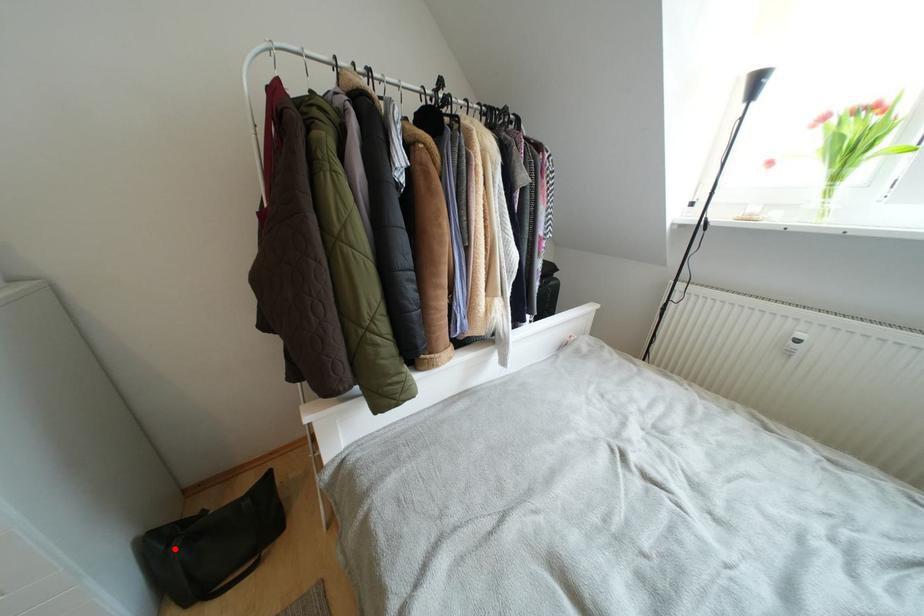
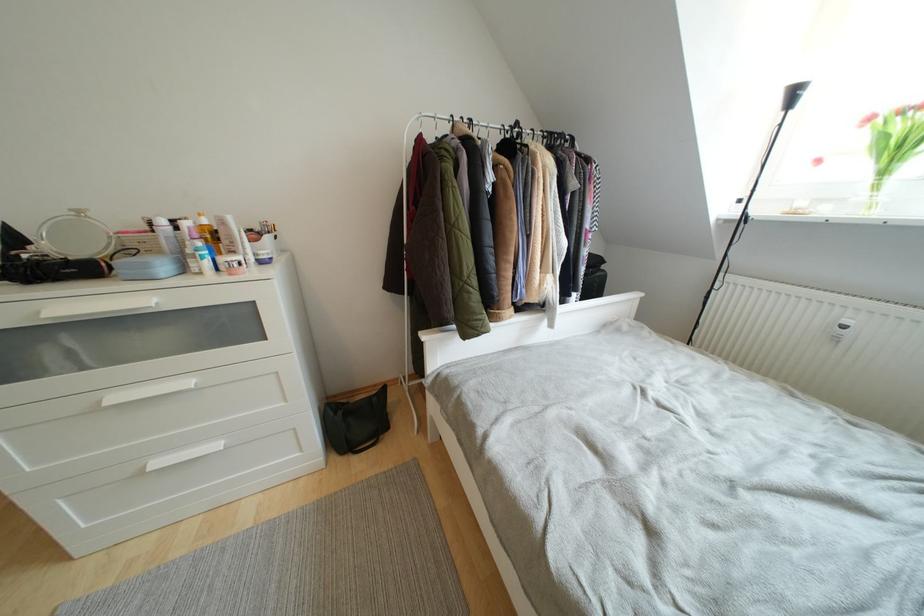
Question: I am providing you with two images of the same scene from different viewpoints. A red point is marked on the first image. Is the red point's position out of view in image 2?

Choices:
 (A) Yes
 (B) No

Answer: (B)